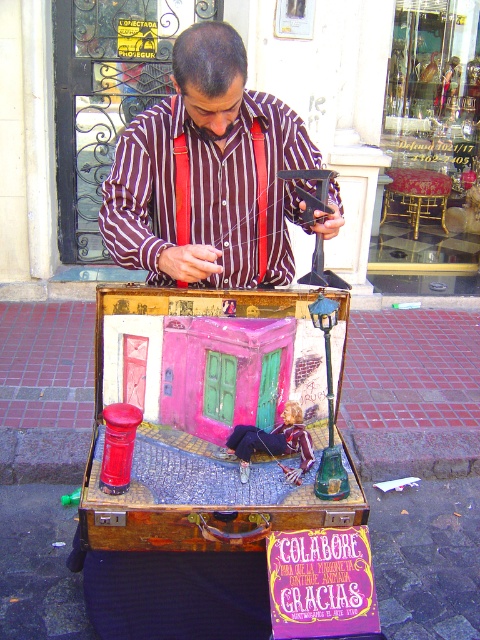
Question: In this image, where is striped cotton shirt at center located relative to metallic silver figure at center?

Choices:
 (A) left
 (B) right

Answer: (A)

Question: Which point is closer to the camera?

Choices:
 (A) metallic silver figure at center
 (B) striped cotton shirt at center

Answer: (A)

Question: Which point appears farthest from the camera in this image?

Choices:
 (A) (286, 444)
 (B) (152, 228)

Answer: (B)

Question: From the image, what is the correct spatial relationship of striped cotton shirt at center in relation to metallic silver figure at center?

Choices:
 (A) above
 (B) below

Answer: (A)

Question: Which point is closer to the camera?

Choices:
 (A) (158, 253)
 (B) (250, 460)

Answer: (A)

Question: Does striped cotton shirt at center have a larger size compared to metallic silver figure at center?

Choices:
 (A) yes
 (B) no

Answer: (A)